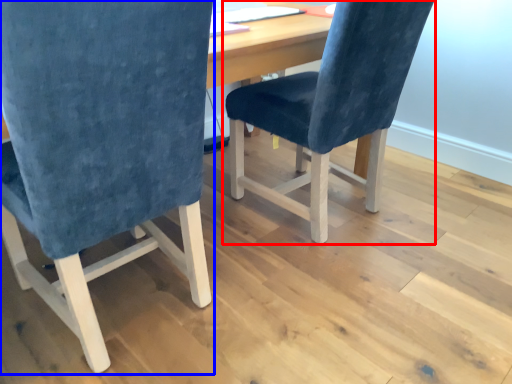
Question: Which of the following is the farthest to the observer, chair (highlighted by a red box) or chair (highlighted by a blue box)?

Choices:
 (A) chair
 (B) chair

Answer: (A)